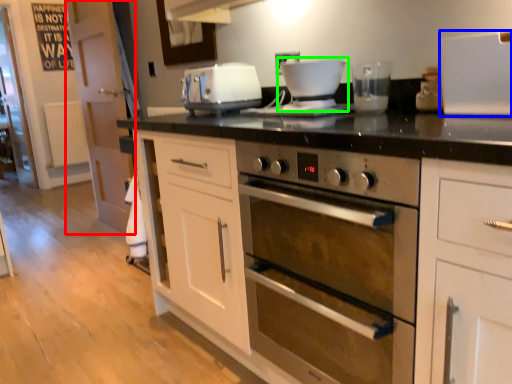
Question: Based on their relative distances, which object is nearer to glass door (highlighted by a red box)? Choose from appliance (highlighted by a blue box) and coffee machine (highlighted by a green box).

Choices:
 (A) appliance
 (B) coffee machine

Answer: (B)